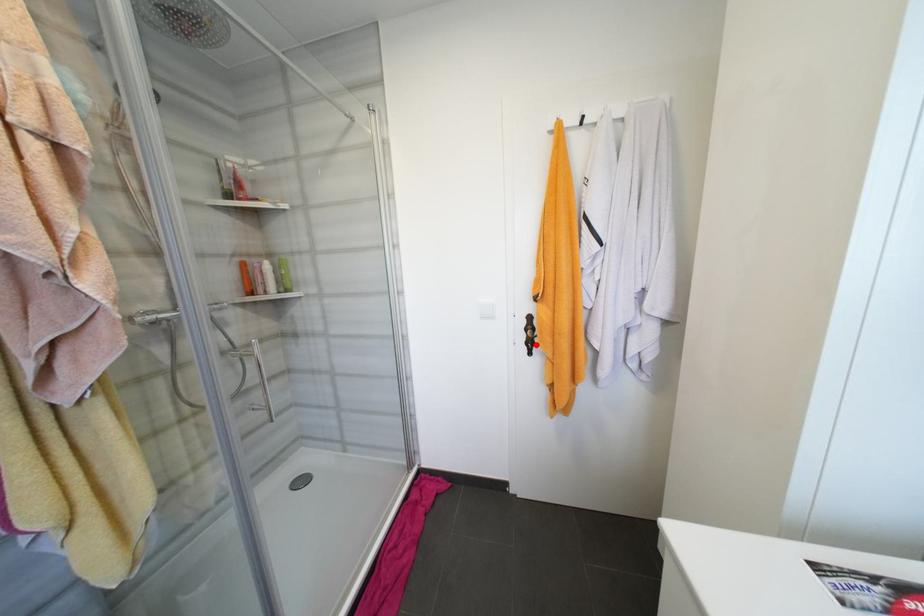
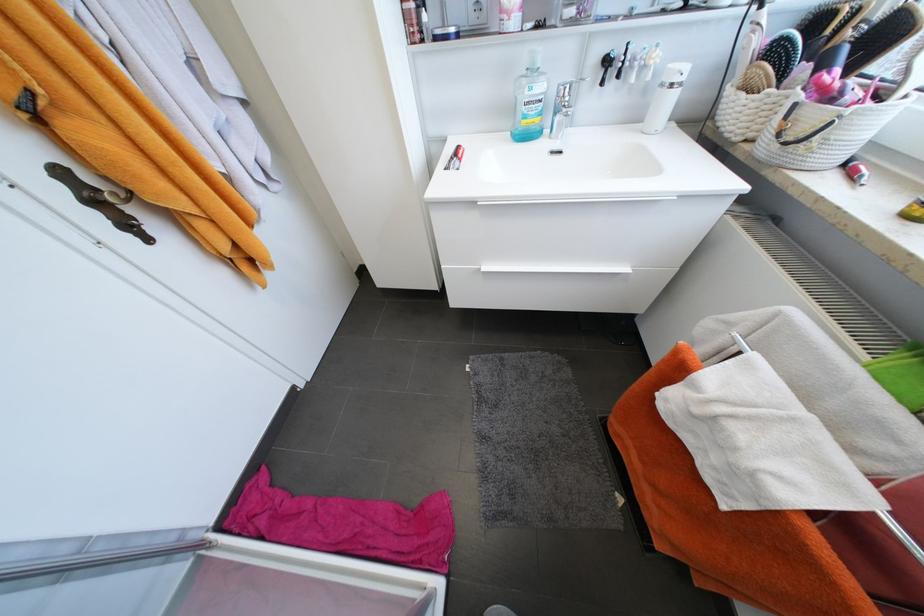
Question: I am providing you with two images of the same scene from different viewpoints. A red point is marked on the first image. At the location where the point appears in image 1, is it still visible in image 2?

Choices:
 (A) Yes
 (B) No

Answer: (A)